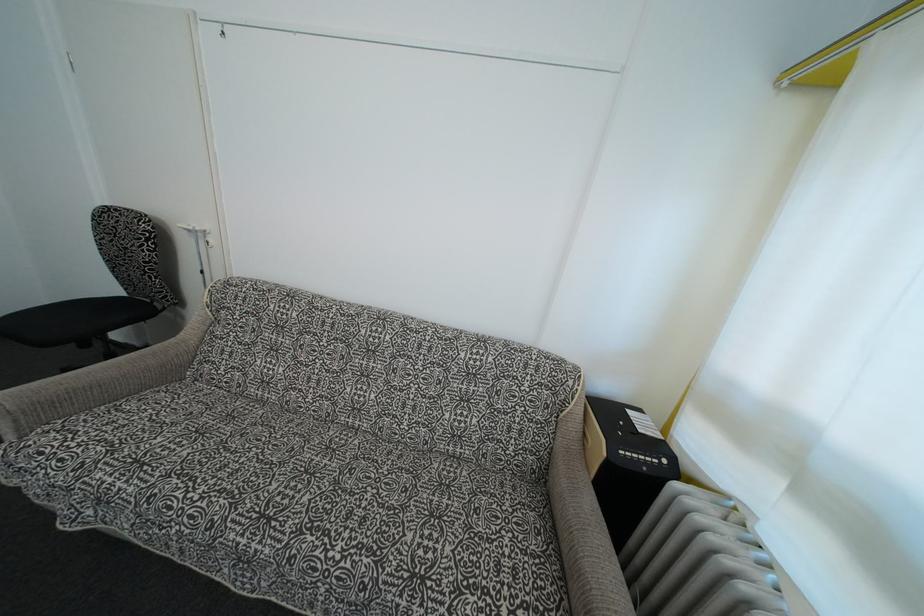
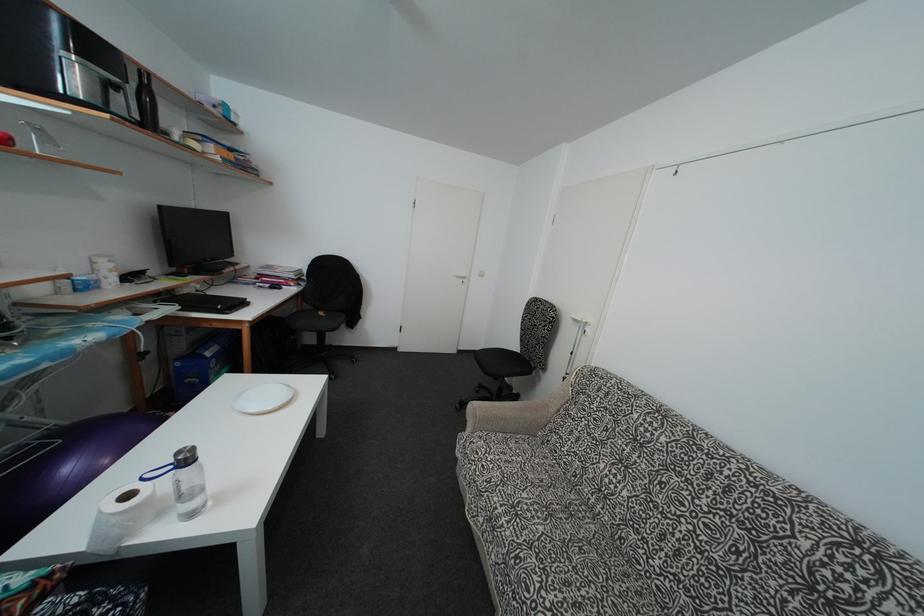
Question: The camera is either moving clockwise (left) or counter-clockwise (right) around the object. The first image is from the beginning of the video and the second image is from the end. Is the camera moving left or right when shooting the video?

Choices:
 (A) Left
 (B) Right

Answer: (B)